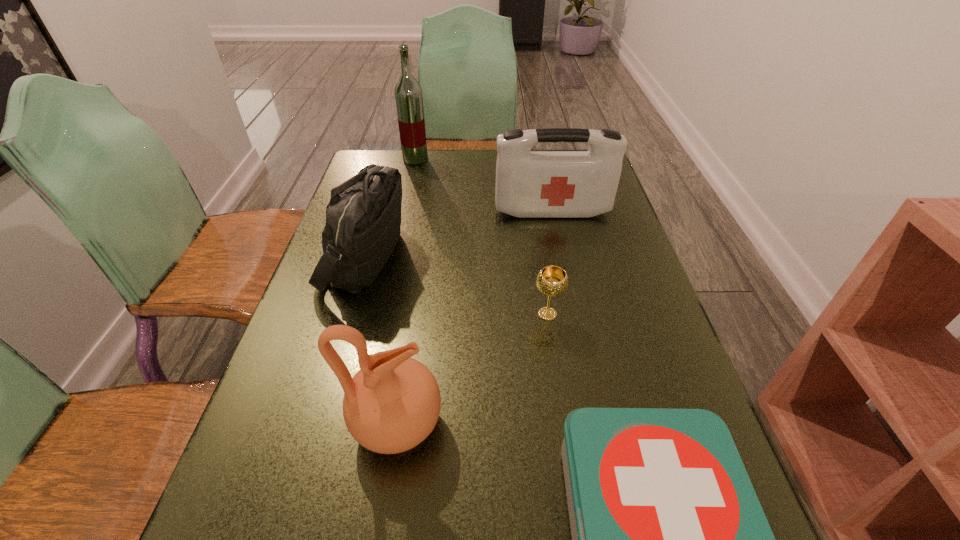
Locate an element on the screen. The image size is (960, 540). free space located 0.300m on the back of the chalice is located at coordinates (534, 224).

Image resolution: width=960 pixels, height=540 pixels. What are the coordinates of `object that is at the far edge` in the screenshot? It's located at (408, 93).

The height and width of the screenshot is (540, 960). In order to click on liquor that is positioned at the left edge in this screenshot , I will do `click(408, 93)`.

Identify the location of shoulder bag that is at the left edge. (363, 218).

You are a GUI agent. You are given a task and a screenshot of the screen. Output one action in this format:
    pyautogui.click(x=<x>, y=<y>)
    Task: Click on the object present at the right edge
    The image size is (960, 540).
    Given the screenshot: What is the action you would take?
    pyautogui.click(x=529, y=184)

This screenshot has width=960, height=540. I want to click on object that is at the far left corner, so click(x=408, y=93).

Where is `free location at the far edge`? This screenshot has height=540, width=960. free location at the far edge is located at coordinates (441, 150).

Image resolution: width=960 pixels, height=540 pixels. I want to click on free space at the left edge, so click(x=340, y=319).

I want to click on free space at the right edge of the desktop, so [612, 303].

In the image, there is a desktop. Identify the location of free space at the far left corner. (380, 157).